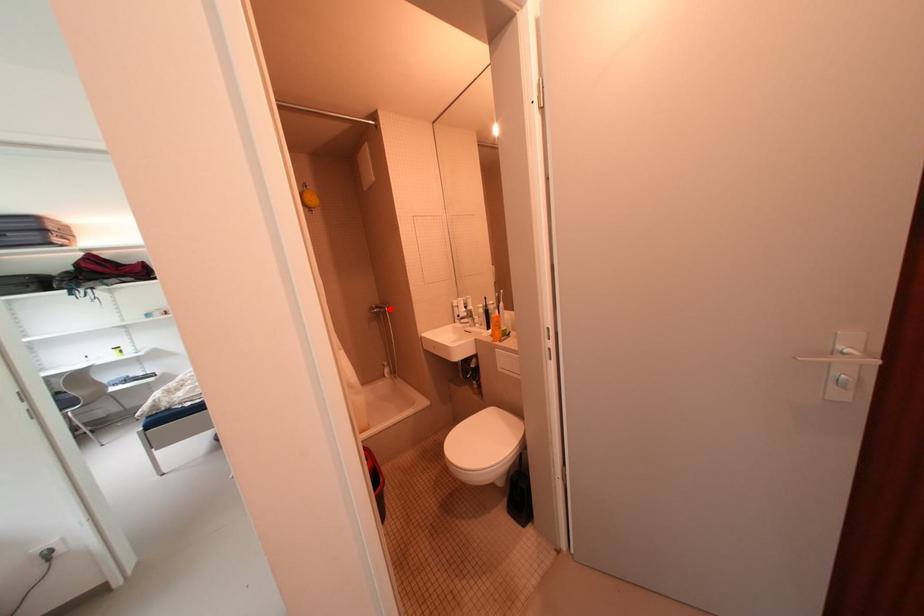
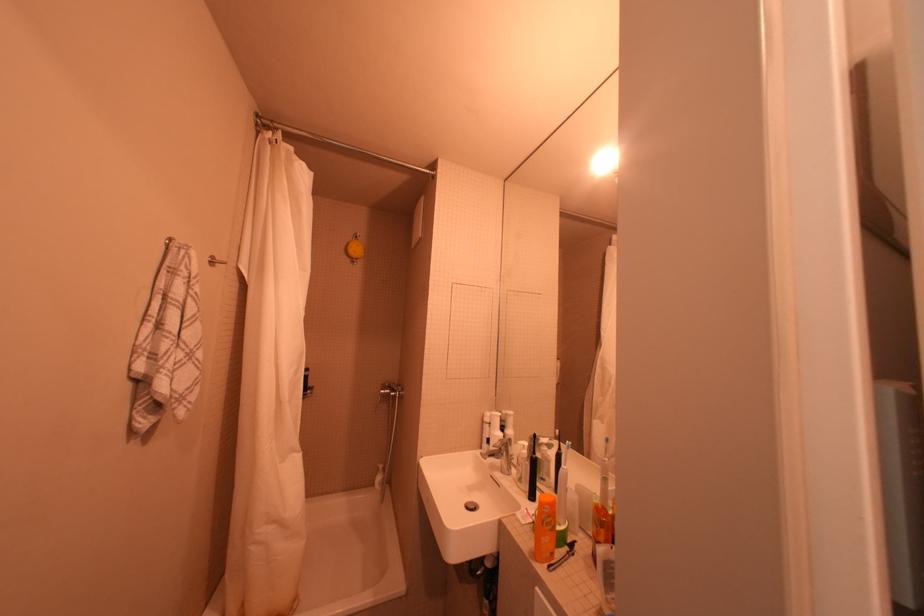
The point at the highlighted location is marked in the first image. Where is the corresponding point in the second image?

(402, 391)